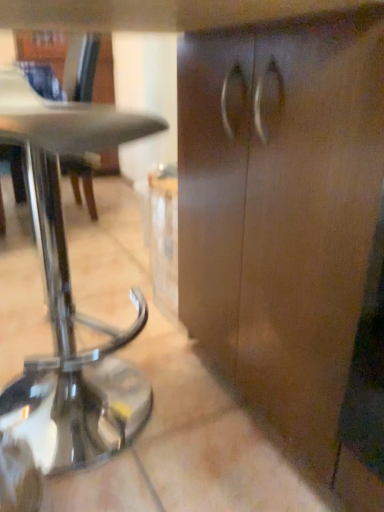
At what (x,y) coordinates should I click in order to perform the action: click on shiny metallic table at left. Please return your answer as a coordinate pair (x, y). This screenshot has width=384, height=512. Looking at the image, I should click on (71, 296).

Describe the element at coordinates (71, 296) in the screenshot. The width and height of the screenshot is (384, 512). I see `shiny metallic table at left` at that location.

The width and height of the screenshot is (384, 512). Find the location of `shiny metallic table at left`. shiny metallic table at left is located at coordinates (71, 296).